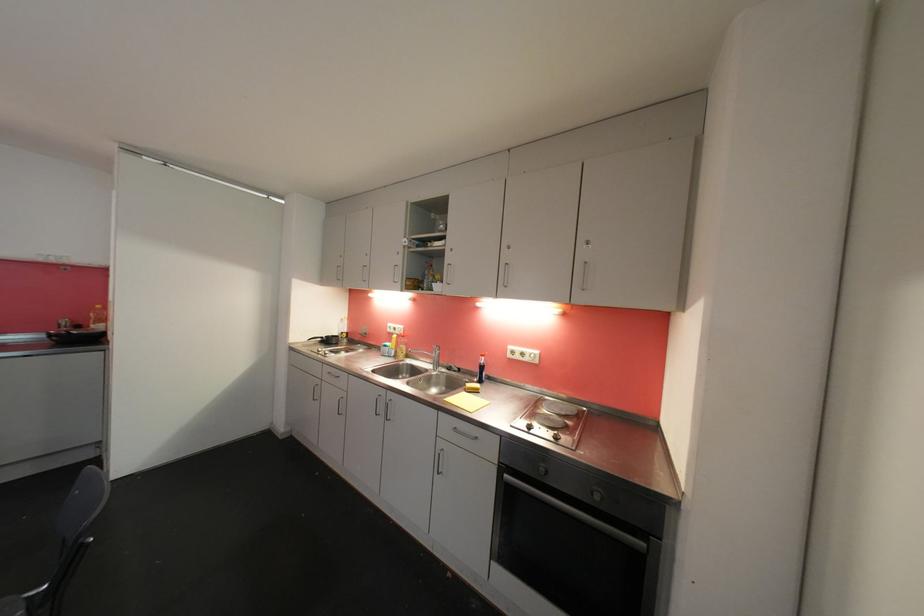
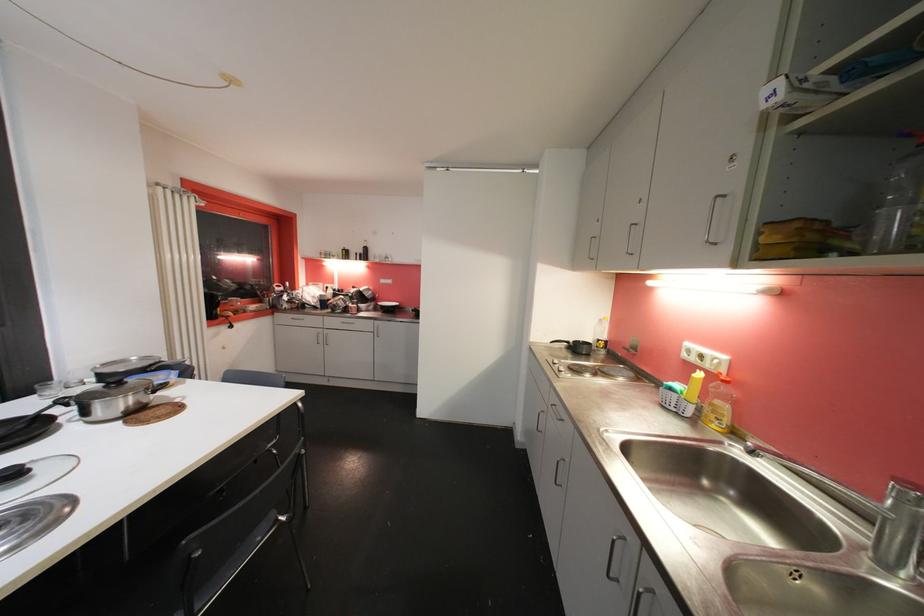
Question: How did the camera likely rotate?

Choices:
 (A) Left
 (B) Right
 (C) Up
 (D) Down

Answer: (A)